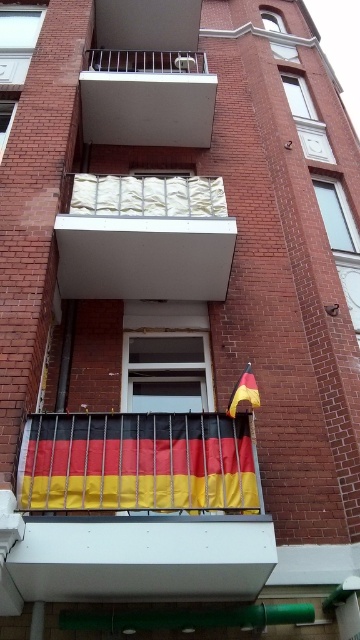
Question: Which point is closer to the camera taking this photo?

Choices:
 (A) (254, 384)
 (B) (10, 74)
 (C) (59, 470)
 (D) (326, 140)

Answer: (C)

Question: Does white glossy window at upper center appear over matte glass window at upper center?

Choices:
 (A) yes
 (B) no

Answer: (B)

Question: Where is transparent glass window at upper right located in relation to clear glass window at upper center in the image?

Choices:
 (A) left
 (B) right

Answer: (B)

Question: Which object appears closest to the camera in this image?

Choices:
 (A) white fabric curtains at upper center
 (B) smooth white balcony at upper center
 (C) transparent glass window at upper left
 (D) white glossy window at upper center

Answer: (A)

Question: Considering the relative positions of transparent glass window at center and clear glass window at upper center in the image provided, where is transparent glass window at center located with respect to clear glass window at upper center?

Choices:
 (A) right
 (B) left

Answer: (B)

Question: Considering the real-world distances, which object is farthest from the german flag fabric at lower center?

Choices:
 (A) transparent glass window at upper right
 (B) transparent glass window at upper left
 (C) transparent glass window at center

Answer: (A)